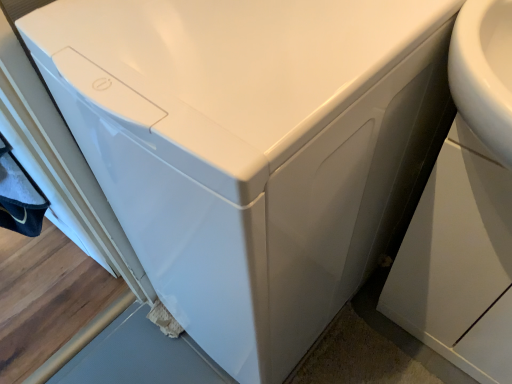
At what (x,y) coordinates should I click in order to perform the action: click on white glossy drawer at lower right. Please return your answer as a coordinate pair (x, y). This screenshot has width=512, height=384. Looking at the image, I should click on (459, 262).

The height and width of the screenshot is (384, 512). Describe the element at coordinates (459, 262) in the screenshot. I see `white glossy drawer at lower right` at that location.

The height and width of the screenshot is (384, 512). Find the location of `white glossy drawer at lower right`. white glossy drawer at lower right is located at coordinates (459, 262).